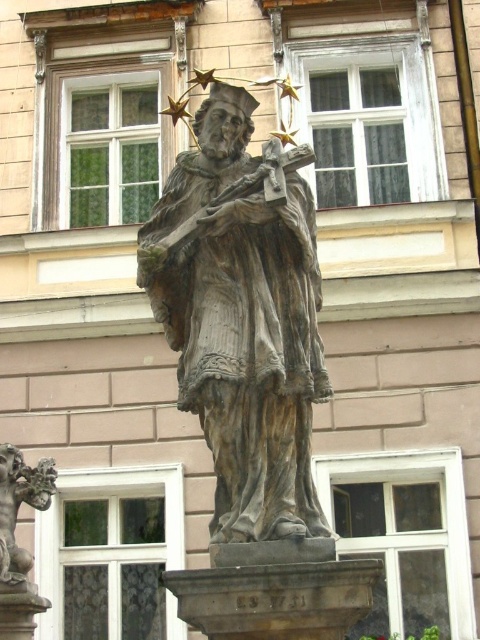
Does wooden statue at center have a greater width compared to bronze statue at lower left?

Yes, wooden statue at center is wider than bronze statue at lower left.

Between wooden statue at center and bronze statue at lower left, which one is positioned lower?

bronze statue at lower left

What do you see at coordinates (242, 316) in the screenshot? I see `wooden statue at center` at bounding box center [242, 316].

Locate an element on the screen. This screenshot has height=640, width=480. wooden statue at center is located at coordinates (242, 316).